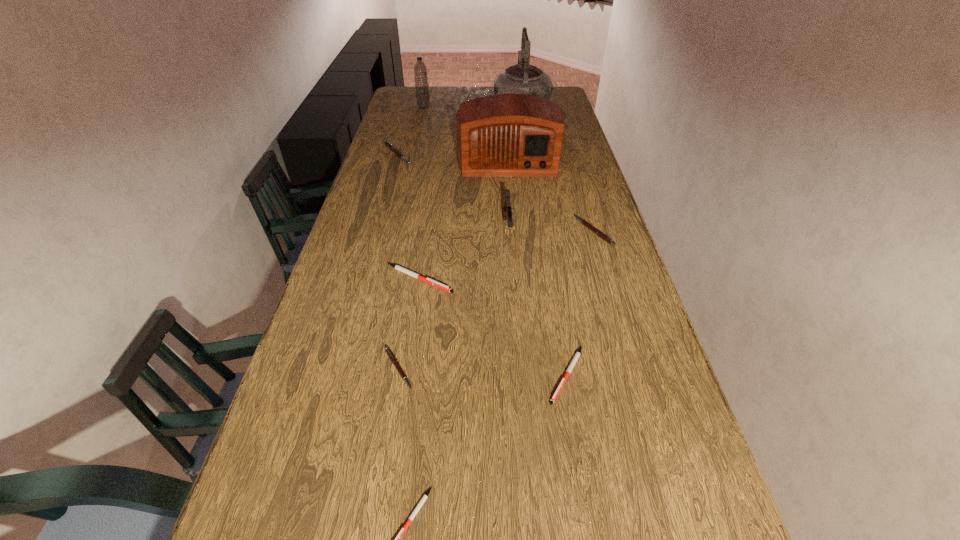
The image size is (960, 540). I want to click on white pen that can be found as the closest to the water bottle, so click(397, 267).